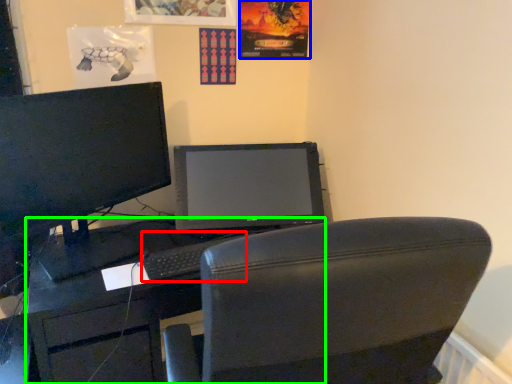
Question: Which object is positioned farthest from keyboard (highlighted by a red box)? Select from poster page (highlighted by a blue box) and desk (highlighted by a green box).

Choices:
 (A) poster page
 (B) desk

Answer: (A)